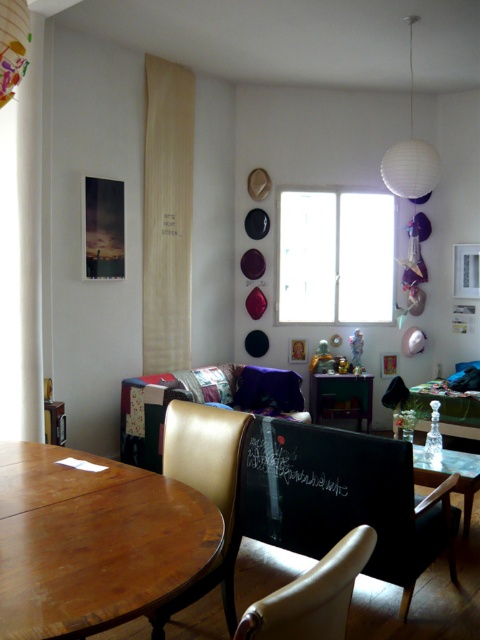
Question: Which object is farther from the camera taking this photo?

Choices:
 (A) leather-like chair at lower left
 (B) wooden curtain at upper left

Answer: (B)

Question: Does wooden curtain at upper left have a greater width compared to wooden table at center?

Choices:
 (A) no
 (B) yes

Answer: (A)

Question: Where is leather armchair at lower center located in relation to wooden table at center in the image?

Choices:
 (A) left
 (B) right

Answer: (A)

Question: Is wooden round table at lower left further to the viewer compared to leather armchair at lower center?

Choices:
 (A) yes
 (B) no

Answer: (A)

Question: Which point appears closest to the camera in this image?

Choices:
 (A) (63, 596)
 (B) (384, 284)
 (C) (180, 72)

Answer: (A)

Question: Which of the following is the closest to the observer?

Choices:
 (A) wooden table at center
 (B) leather-like chair at lower left
 (C) wooden round table at lower left
 (D) wooden curtain at upper left

Answer: (C)